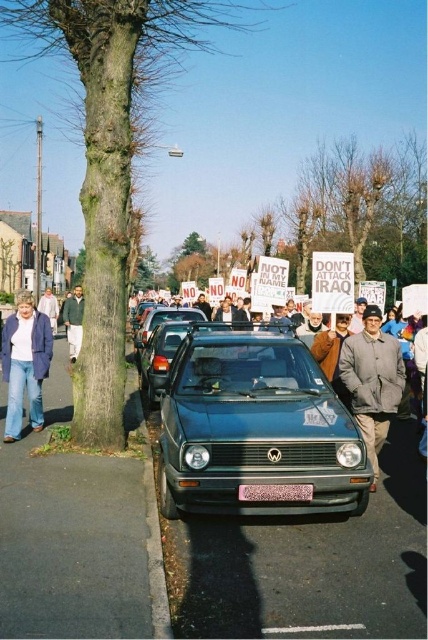
Is green bark tree at left shorter than metallic silver hatchback at center?

No, green bark tree at left is not shorter than metallic silver hatchback at center.

Is point (82, 198) behind point (148, 317)?

No.

You are a GUI agent. You are given a task and a screenshot of the screen. Output one action in this format:
    pyautogui.click(x=<x>, y=<y>)
    Task: Click on the green bark tree at left
    Image resolution: width=428 pixels, height=640 pixels.
    Given the screenshot: What is the action you would take?
    pyautogui.click(x=112, y=156)

Can you confirm if metallic blue hatchback at center is smaller than pink plastic license plate at center?

Incorrect, metallic blue hatchback at center is not smaller in size than pink plastic license plate at center.

Consider the image. Between metallic blue hatchback at center and pink plastic license plate at center, which one is positioned lower?

pink plastic license plate at center is lower down.

Which is in front, point (172, 330) or point (284, 484)?

Point (284, 484) is more forward.

The image size is (428, 640). Find the location of `metallic blue hatchback at center`. metallic blue hatchback at center is located at coordinates (166, 355).

Measure the distance from denim jacket at lower left to pink plastic license plate at center.

denim jacket at lower left and pink plastic license plate at center are 3.88 meters apart from each other.

Is denim jacket at lower left positioned behind pink plastic license plate at center?

Yes, denim jacket at lower left is further from the viewer.

Image resolution: width=428 pixels, height=640 pixels. Identify the location of denim jacket at lower left. (24, 364).

You are a GUI agent. You are given a task and a screenshot of the screen. Output one action in this format:
    pyautogui.click(x=<x>, y=<y>)
    Task: Click on the denim jacket at lower left
    
    Given the screenshot: What is the action you would take?
    pyautogui.click(x=24, y=364)